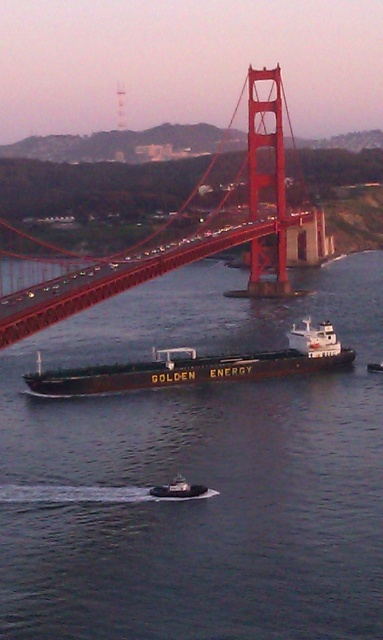
Question: Which object is closer to the camera taking this photo?

Choices:
 (A) brown matte cargo ship at center
 (B) brown matte water at center
 (C) metallic gray tugboat at center

Answer: (B)

Question: Which point is farther to the camera?

Choices:
 (A) coord(320,324)
 (B) coord(170,486)
 (C) coord(284,275)
 (D) coord(176,298)

Answer: (C)

Question: Is brown matte cargo ship at center thinner than metallic gray tugboat at center?

Choices:
 (A) yes
 (B) no

Answer: (B)

Question: Is brown matte cargo ship at center smaller than metallic gray tugboat at center?

Choices:
 (A) no
 (B) yes

Answer: (A)

Question: Which of the following is the farthest from the observer?

Choices:
 (A) brown matte water at center
 (B) red painted steel golden gate bridge at center

Answer: (B)

Question: Can you confirm if red painted steel golden gate bridge at center is positioned to the left of metallic gray tugboat at center?

Choices:
 (A) no
 (B) yes

Answer: (B)